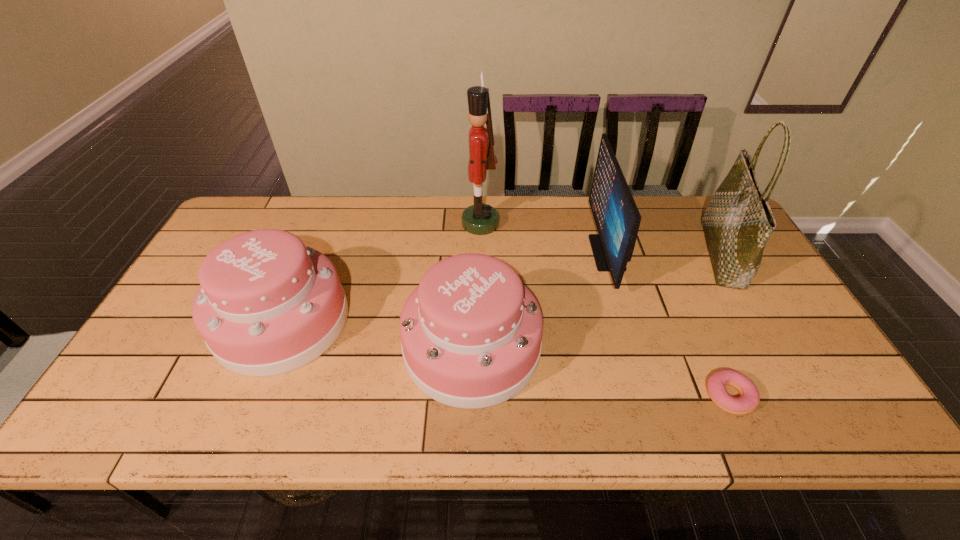
The image size is (960, 540). In order to click on nutcracker in this screenshot , I will do `click(479, 219)`.

The width and height of the screenshot is (960, 540). Find the location of `the rightmost object`. the rightmost object is located at coordinates (738, 221).

This screenshot has width=960, height=540. I want to click on the third object from right to left, so click(617, 218).

Locate an element on the screen. This screenshot has width=960, height=540. computer monitor is located at coordinates (617, 218).

I want to click on the leftmost object, so click(267, 305).

Identify the location of cake. The height and width of the screenshot is (540, 960). (471, 333).

I want to click on doughnut, so click(x=716, y=385).

Where is `the second object from right to left`? The height and width of the screenshot is (540, 960). the second object from right to left is located at coordinates (x=716, y=385).

Find the location of a particular element. This screenshot has height=540, width=960. free spot located 0.190m on the front-facing side of the nutcracker is located at coordinates (403, 224).

In order to click on free space located on the front-facing side of the nutcracker in this screenshot , I will do `click(348, 224)`.